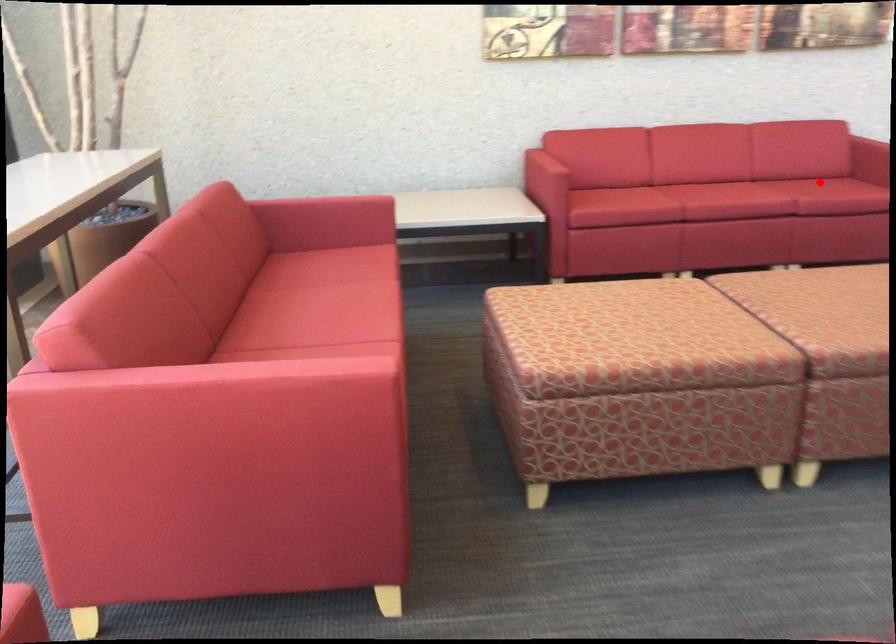
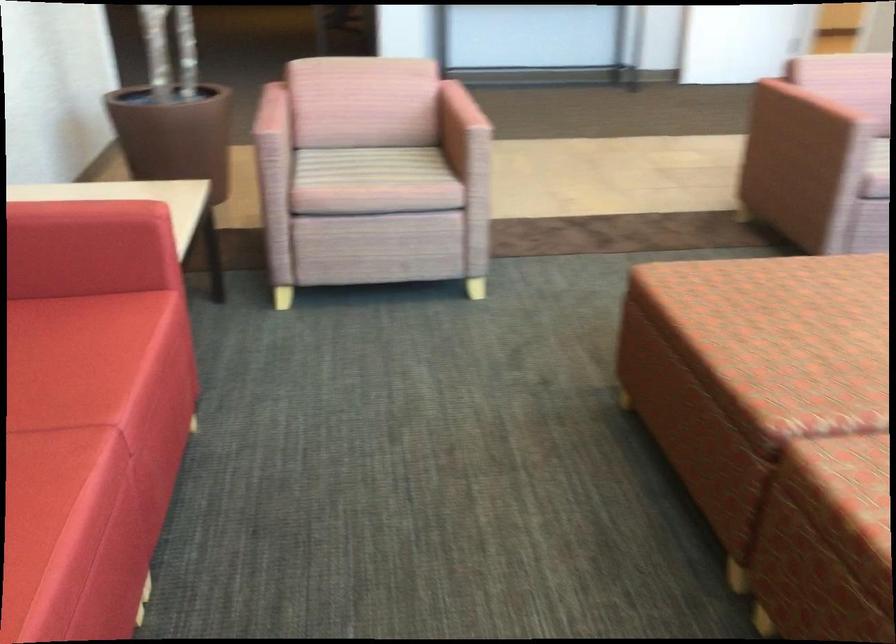
Question: I am providing you with two images of the same scene from different viewpoints. In image1, a red point is highlighted. Considering the same 3D point in image2, which of the following is correct?

Choices:
 (A) It is closer
 (B) It is farther

Answer: (A)